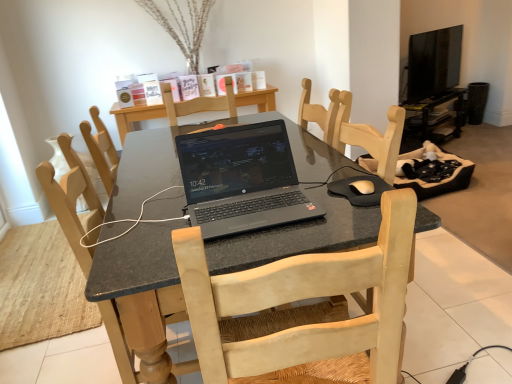
Locate an element on the screen. This screenshot has height=384, width=512. vacant area that is in front of black rubber mousepad at center is located at coordinates (353, 220).